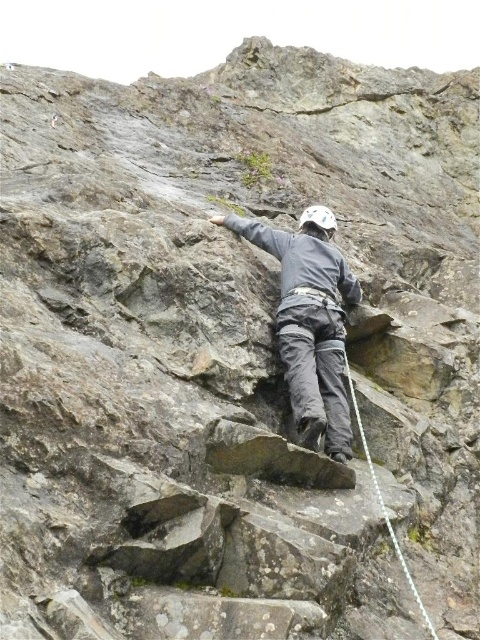
Question: Which point is closer to the camera?

Choices:
 (A) white nylon rope at center
 (B) gray fabric climbing suit at center

Answer: (A)

Question: Is gray fabric climbing suit at center to the right of white nylon rope at center from the viewer's perspective?

Choices:
 (A) yes
 (B) no

Answer: (B)

Question: Is gray fabric climbing suit at center bigger than white nylon rope at center?

Choices:
 (A) no
 (B) yes

Answer: (B)

Question: Does gray fabric climbing suit at center come behind white nylon rope at center?

Choices:
 (A) no
 (B) yes

Answer: (B)

Question: Which point appears farthest from the camera in this image?

Choices:
 (A) (399, 561)
 (B) (300, 260)

Answer: (B)